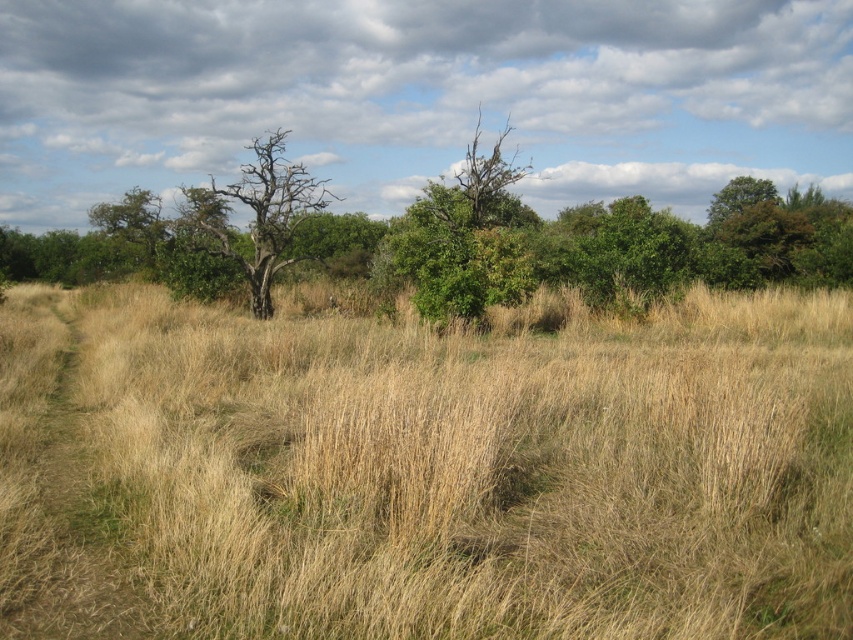
You are standing in the field of tall dry grass and see both the green leafy tree at center and the bare wood tree at center. Which tree is positioned to the right side?

The green leafy tree at center is positioned to the right of the bare wood tree at center.

You are a hiker trying to navigate through the dry grass at center and the bare wood tree at center. Which object would you need to step over if you want to avoid touching them?

The dry grass at center has a smaller size compared to the bare wood tree at center, so you would need to step over the dry grass at center to avoid touching it.

In the scene shown: You are standing at the point closer to the background in the image. Which point are you at, point (666, 529) or point (259, 141)?

You are at point (259, 141) because it is behind point (666, 529), so it is closer to the background.